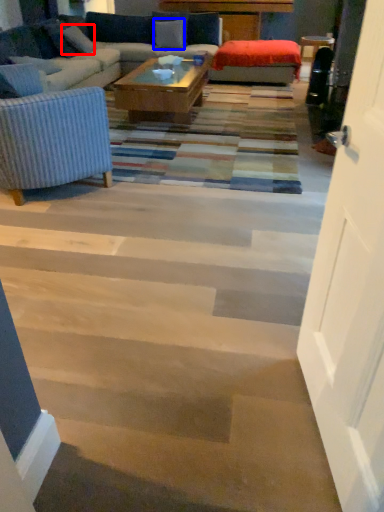
Question: Which point is closer to the camera, pillow (highlighted by a red box) or pillow (highlighted by a blue box)?

Choices:
 (A) pillow
 (B) pillow

Answer: (A)